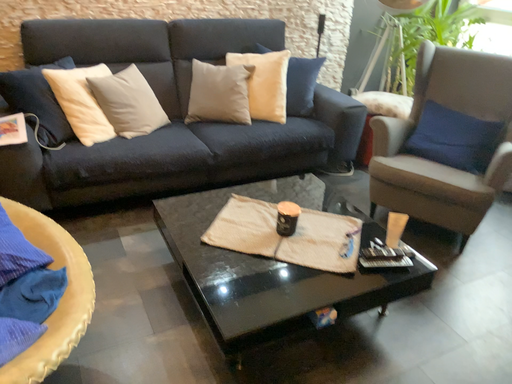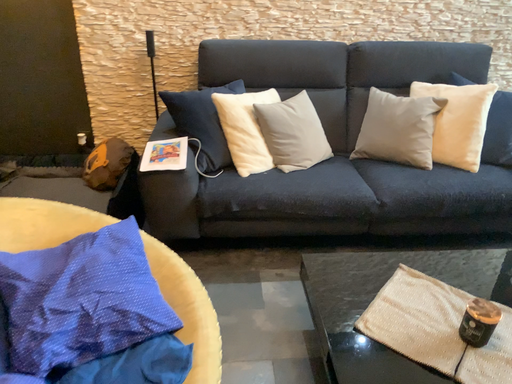
Question: Which way did the camera rotate in the video?

Choices:
 (A) rotated right
 (B) rotated left

Answer: (B)